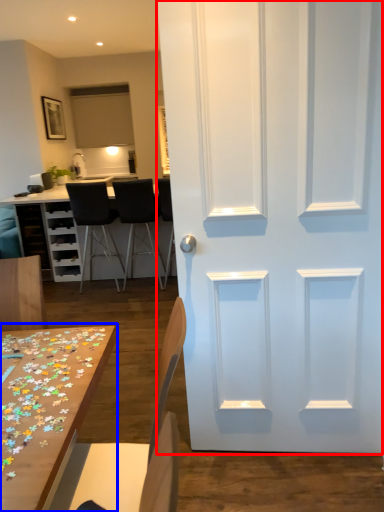
Question: Which point is closer to the camera, door (highlighted by a red box) or table (highlighted by a blue box)?

Choices:
 (A) door
 (B) table

Answer: (B)